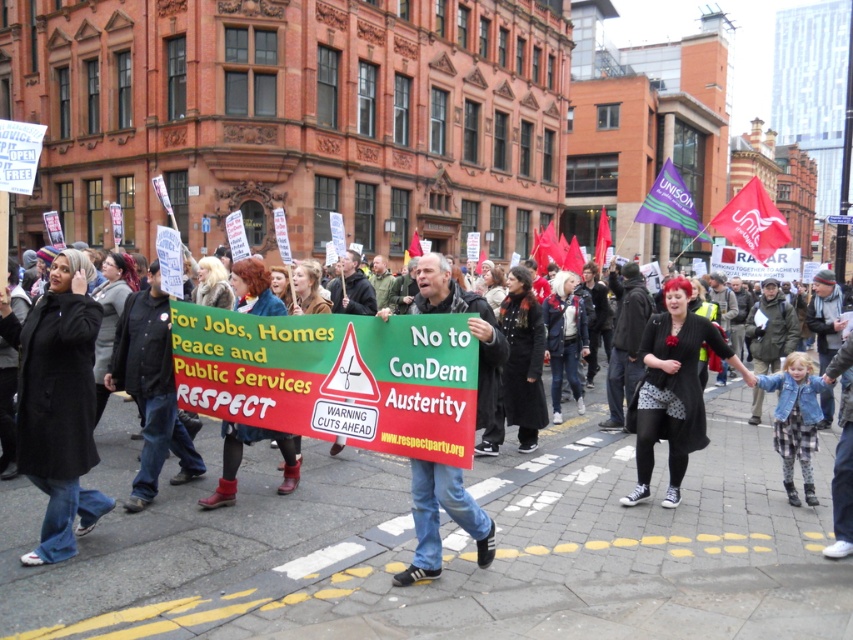
Question: Estimate the real-world distances between objects in this image. Which object is farther from the green fabric sign at center?

Choices:
 (A) black textured coat at center
 (B) black wool coat at left

Answer: (A)

Question: Which point is farther from the camera taking this photo?

Choices:
 (A) (433, 362)
 (B) (431, 284)

Answer: (B)

Question: Can you confirm if black wool coat at left is positioned above green fabric sign at center?

Choices:
 (A) no
 (B) yes

Answer: (B)

Question: Which of the following is the closest to the observer?

Choices:
 (A) black textured coat at center
 (B) black wool coat at left

Answer: (B)

Question: Is black textured coat at center above green fabric sign at center?

Choices:
 (A) yes
 (B) no

Answer: (A)

Question: Can you confirm if black textured coat at center is bigger than green fabric sign at center?

Choices:
 (A) yes
 (B) no

Answer: (A)